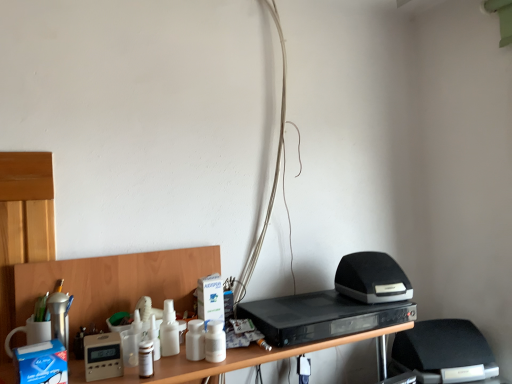
The width and height of the screenshot is (512, 384). In order to click on vacant space that is to the left of black matte speaker at right, which is the second appliance from bottom to top in this screenshot , I will do `click(317, 308)`.